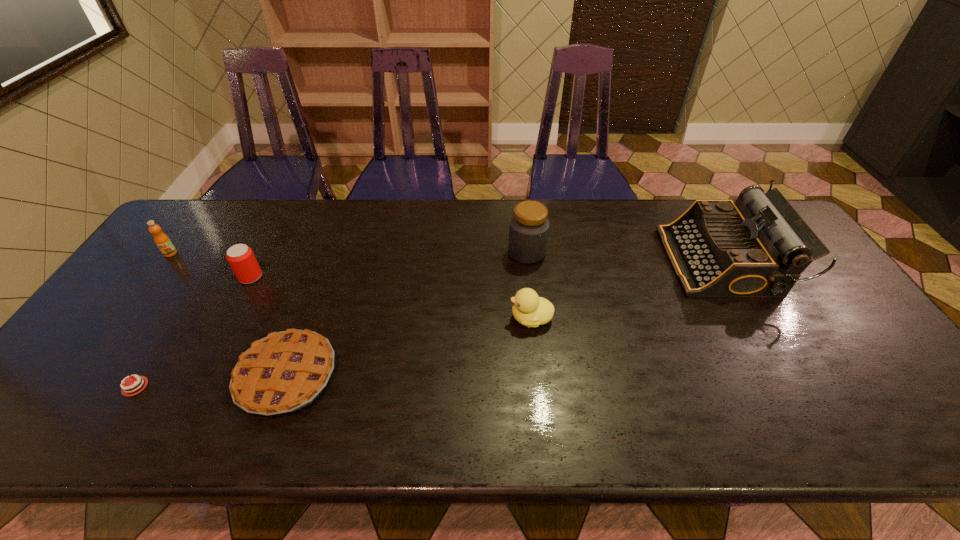
Find the location of a particular element. The image size is (960, 540). free location that satisfies the following two spatial constraints: 1. on the surface of the jar near the warning symbol; 2. on the front label of the leftmost object is located at coordinates (527, 253).

Where is `free location that satisfies the following two spatial constraints: 1. on the keyboard of the rightmost object; 2. on the front side of the chocolate cake`? This screenshot has width=960, height=540. free location that satisfies the following two spatial constraints: 1. on the keyboard of the rightmost object; 2. on the front side of the chocolate cake is located at coordinates (794, 387).

Locate an element on the screen. Image resolution: width=960 pixels, height=540 pixels. free space that satisfies the following two spatial constraints: 1. on the surface of the jar near the warning symbol; 2. on the front side of the pie is located at coordinates (540, 377).

Find the location of a particular element. The width and height of the screenshot is (960, 540). vacant space that satisfies the following two spatial constraints: 1. on the surface of the jar near the warning symbol; 2. on the front label of the orange juice is located at coordinates (527, 253).